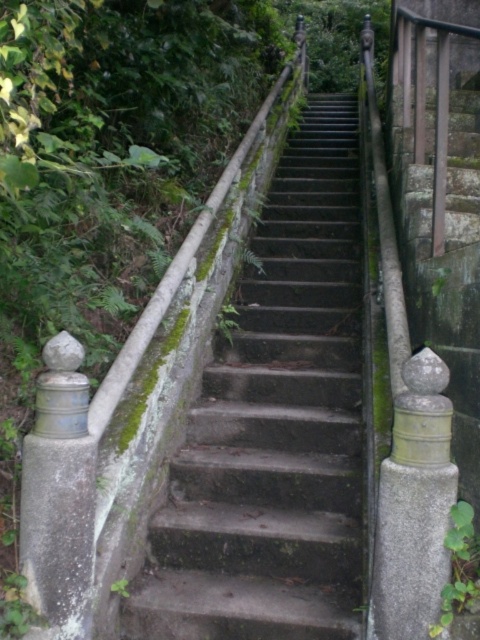
Question: Is concrete stairs at center in front of green mossy wall at upper left?

Choices:
 (A) yes
 (B) no

Answer: (B)

Question: Where is concrete stairs at center located in relation to green mossy wall at upper left in the image?

Choices:
 (A) below
 (B) above

Answer: (A)

Question: Can you confirm if concrete stairs at center is smaller than green mossy wall at upper left?

Choices:
 (A) yes
 (B) no

Answer: (B)

Question: Which of the following is the farthest from the observer?

Choices:
 (A) (128, 349)
 (B) (356, 176)

Answer: (B)